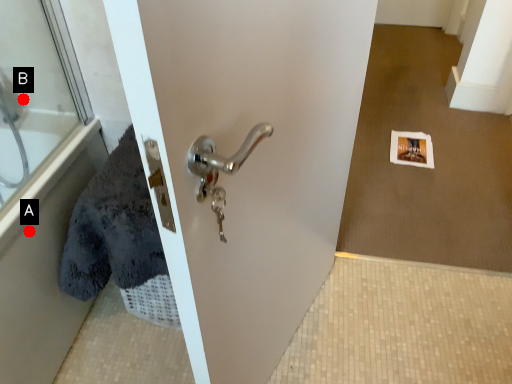
Question: Two points are circled on the image, labeled by A and B beside each circle. Which point is closer to the camera?

Choices:
 (A) A is closer
 (B) B is closer

Answer: (A)